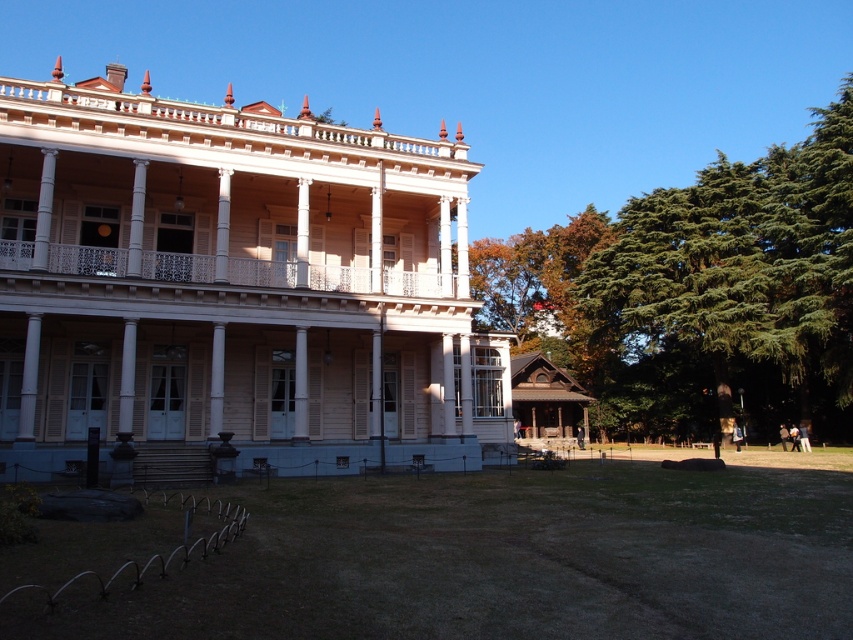
Question: Can you confirm if light beige wood mansion at center is smaller than green grass at lower center?

Choices:
 (A) no
 (B) yes

Answer: (A)

Question: Can you confirm if light beige wood mansion at center is wider than white painted wood porch at center?

Choices:
 (A) no
 (B) yes

Answer: (B)

Question: Which object is positioned farthest from the light beige wood mansion at center?

Choices:
 (A) white painted wood porch at center
 (B) green grass at lower center

Answer: (B)

Question: Can you confirm if light beige wood mansion at center is thinner than green grass at lower center?

Choices:
 (A) yes
 (B) no

Answer: (B)

Question: Which point is closer to the camera?

Choices:
 (A) (363, 557)
 (B) (483, 394)

Answer: (A)

Question: Which of these objects is positioned closest to the green grass at lower center?

Choices:
 (A) white painted wood porch at center
 (B) light beige wood mansion at center

Answer: (B)